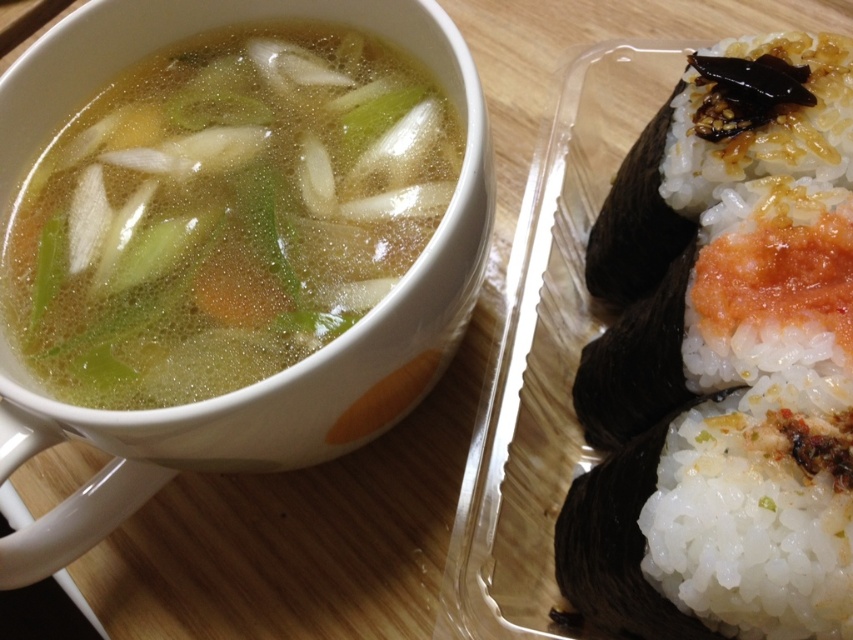
You are holding a camera and want to take a photo of the point at coordinates (296, 227). The camera is currently 25.35 inches away from the point. If the camera needs to be exactly 24 inches away to capture a clear photo, should you move the camera closer or farther away?

The camera is currently 25.35 inches away from the point, so you should move it closer to achieve the required 24 inches distance.

You are a delivery person standing at the entrance of the kitchen. You need to place a small package on the surface between the two points, point (701,202) and point (578,492). Which point should you approach first to ensure the package is placed correctly?

You should approach point (701,202) first because it is in front of point (578,492), so placing the package closer to the front point ensures it is correctly positioned between them.

You are a food delivery person who needs to pick up the container of sushi. The container is located at point (723, 364). The wooden surface is 1 meter long. Can you reach the container without moving your hand beyond the edge of the wooden surface?

The white rice with nori at right is represented by point (723, 364), so the container is within the wooden surface which is 1 meter long. Therefore, you can reach the container without moving your hand beyond the edge of the wooden surface.